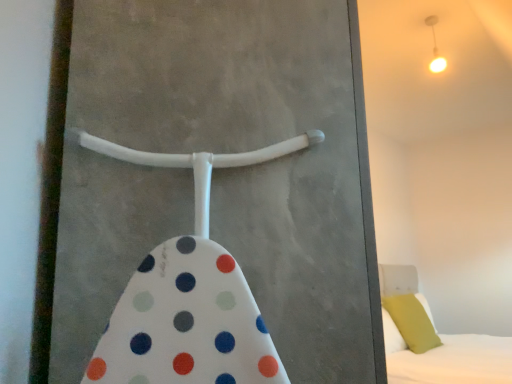
Find the location of a particular element. The width and height of the screenshot is (512, 384). white soft bed at lower right is located at coordinates (434, 340).

Image resolution: width=512 pixels, height=384 pixels. Find the location of `matte white light fixture at upper right`. matte white light fixture at upper right is located at coordinates (435, 48).

Where is `white plastic screen door at center`? This screenshot has height=384, width=512. white plastic screen door at center is located at coordinates (253, 149).

From a real-world perspective, which object rests below the other?

soft green pillow at right.

Where is `light fixture that is on the left side of soft green pillow at right`? The width and height of the screenshot is (512, 384). light fixture that is on the left side of soft green pillow at right is located at coordinates (435, 48).

Is soft green pillow at right surrounding matte white light fixture at upper right?

Actually, matte white light fixture at upper right is outside soft green pillow at right.

Is matte white light fixture at upper right not near soft green pillow at right?

That's right, there is a large distance between matte white light fixture at upper right and soft green pillow at right.

Who is bigger, matte white light fixture at upper right or soft green pillow at right?

Bigger between the two is soft green pillow at right.

From a real-world perspective, who is located lower, matte white light fixture at upper right or soft green pillow at right?

soft green pillow at right.

From a real-world perspective, is white plastic screen door at center over matte white light fixture at upper right?

No, from a real-world perspective, white plastic screen door at center is not above matte white light fixture at upper right.

Considering the relative positions of white plastic screen door at center and matte white light fixture at upper right in the image provided, is white plastic screen door at center to the right of matte white light fixture at upper right from the viewer's perspective?

In fact, white plastic screen door at center is to the left of matte white light fixture at upper right.

Is white plastic screen door at center oriented away from matte white light fixture at upper right?

No.

From a real-world perspective, is soft green pillow at right below white plastic screen door at center?

Yes, from a real-world perspective, soft green pillow at right is under white plastic screen door at center.

Which is farther, (410,320) or (228,144)?

Point (410,320)

In the image, is soft green pillow at right positioned in front of or behind white plastic screen door at center?

Clearly, soft green pillow at right is behind white plastic screen door at center.

Could you tell me if soft green pillow at right is facing white plastic screen door at center?

No.

From a real-world perspective, is white soft bed at lower right on white plastic screen door at center?

No, from a real-world perspective, white soft bed at lower right is not above white plastic screen door at center.

Considering the relative sizes of white soft bed at lower right and white plastic screen door at center in the image provided, is white soft bed at lower right wider than white plastic screen door at center?

Correct, the width of white soft bed at lower right exceeds that of white plastic screen door at center.

Looking at this image, considering the relative positions of white soft bed at lower right and white plastic screen door at center in the image provided, is white soft bed at lower right to the left or to the right of white plastic screen door at center?

In the image, white soft bed at lower right appears on the right side of white plastic screen door at center.

Would you say white soft bed at lower right is outside white plastic screen door at center?

Yes, white soft bed at lower right is not within white plastic screen door at center.

From the image's perspective, between matte white light fixture at upper right and white soft bed at lower right, who is located below?

white soft bed at lower right appears lower in the image.

Consider the image. Can you confirm if matte white light fixture at upper right is positioned to the left of white soft bed at lower right?

Yes.

Could white soft bed at lower right be considered to be inside matte white light fixture at upper right?

Actually, white soft bed at lower right is outside matte white light fixture at upper right.

From a real-world perspective, is matte white light fixture at upper right positioned under white soft bed at lower right based on gravity?

Actually, matte white light fixture at upper right is physically above white soft bed at lower right in the real world.

Based on the photo, is matte white light fixture at upper right smaller than white plastic screen door at center?

Indeed, matte white light fixture at upper right has a smaller size compared to white plastic screen door at center.

In the scene shown: Is matte white light fixture at upper right located outside white plastic screen door at center?

Indeed, matte white light fixture at upper right is completely outside white plastic screen door at center.

Is matte white light fixture at upper right positioned far away from white plastic screen door at center?

Yes, matte white light fixture at upper right is far from white plastic screen door at center.

Between point (436, 19) and point (149, 170), which one is positioned behind?

The point (436, 19) is farther.

Where is `pillow below the matte white light fixture at upper right (from the image's perspective)`? pillow below the matte white light fixture at upper right (from the image's perspective) is located at coordinates (412, 322).

Image resolution: width=512 pixels, height=384 pixels. In order to click on light fixture on the left of soft green pillow at right in this screenshot , I will do `click(435, 48)`.

Considering their positions, is matte white light fixture at upper right positioned closer to soft green pillow at right than white plastic screen door at center?

matte white light fixture at upper right lies closer to soft green pillow at right than the other object.

Estimate the real-world distances between objects in this image. Which object is further from soft green pillow at right, white soft bed at lower right or matte white light fixture at upper right?

A: matte white light fixture at upper right is further to soft green pillow at right.

Looking at the image, which one is located further to soft green pillow at right, matte white light fixture at upper right or white soft bed at lower right?

The object further to soft green pillow at right is matte white light fixture at upper right.

From the image, which object appears to be farther from matte white light fixture at upper right, white soft bed at lower right or white plastic screen door at center?

Among the two, white plastic screen door at center is located further to matte white light fixture at upper right.

Looking at the image, which one is located further to matte white light fixture at upper right, soft green pillow at right or white plastic screen door at center?

Based on the image, white plastic screen door at center appears to be further to matte white light fixture at upper right.

Based on their spatial positions, is white plastic screen door at center or white soft bed at lower right closer to matte white light fixture at upper right?

white soft bed at lower right is positioned closer to the anchor matte white light fixture at upper right.

Looking at the image, which one is located further to soft green pillow at right, white soft bed at lower right or white plastic screen door at center?

white plastic screen door at center.

Estimate the real-world distances between objects in this image. Which object is closer to white soft bed at lower right, soft green pillow at right or white plastic screen door at center?

soft green pillow at right is closer to white soft bed at lower right.

You are a GUI agent. You are given a task and a screenshot of the screen. Output one action in this format:
    pyautogui.click(x=<x>, y=<y>)
    Task: Click on the pillow between matte white light fixture at upper right and white soft bed at lower right in the up-down direction
    The image size is (512, 384).
    Given the screenshot: What is the action you would take?
    pyautogui.click(x=412, y=322)

At what (x,y) coordinates should I click in order to perform the action: click on screen door between matte white light fixture at upper right and white soft bed at lower right in the up-down direction. Please return your answer as a coordinate pair (x, y). Looking at the image, I should click on (253, 149).

The image size is (512, 384). In order to click on bed between white plastic screen door at center and soft green pillow at right from front to back in this screenshot , I will do `click(434, 340)`.

Locate an element on the screen. This screenshot has width=512, height=384. light fixture positioned between white plastic screen door at center and soft green pillow at right from near to far is located at coordinates (435, 48).